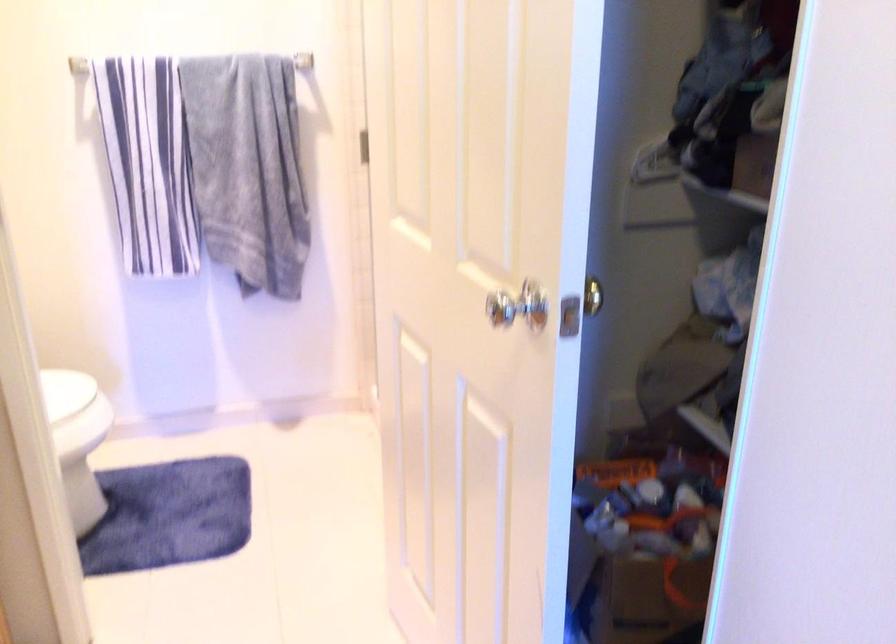
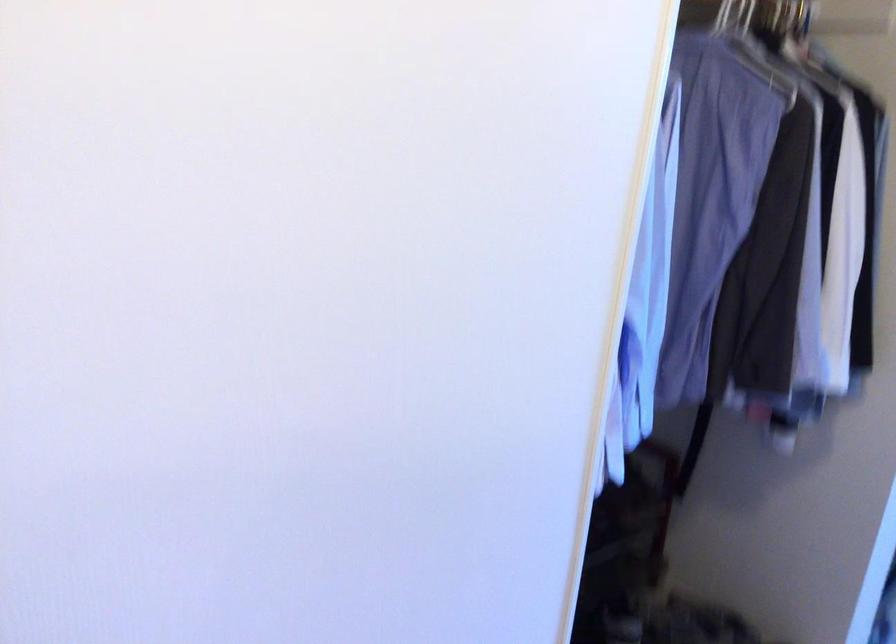
Based on the continuous images, in which direction is the camera rotating?

The camera's rotation is toward right-down.